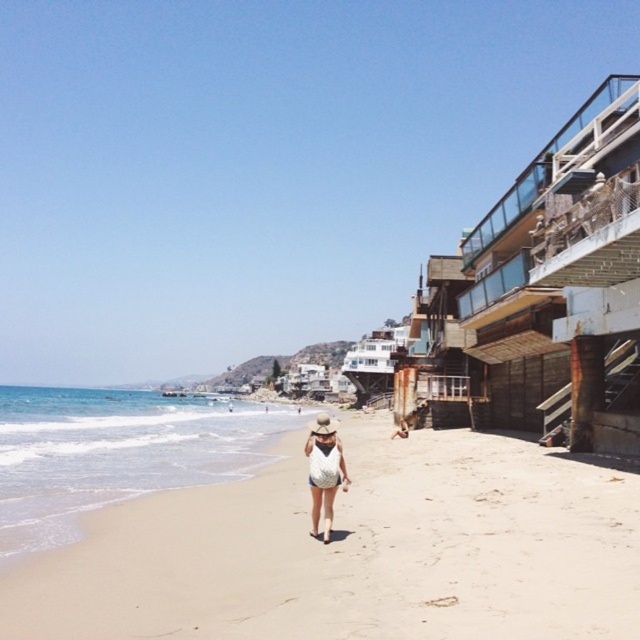
What do you see at coordinates (355, 552) in the screenshot? I see `beige sandy beach at center` at bounding box center [355, 552].

Which is in front, point (538, 618) or point (330, 524)?

Point (538, 618)

Find the location of a particular element. This screenshot has width=640, height=640. beige sandy beach at center is located at coordinates (355, 552).